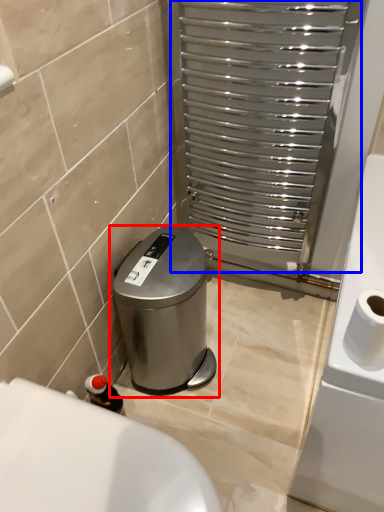
Question: Which object is further to the camera taking this photo, waste container (highlighted by a red box) or screen door (highlighted by a blue box)?

Choices:
 (A) waste container
 (B) screen door

Answer: (A)